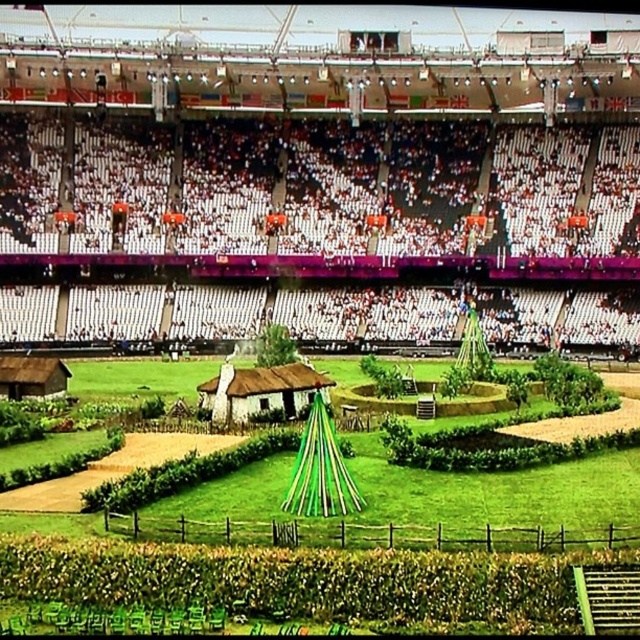
In the scene shown: Does rustic thatched hut at center have a greater height compared to brown wooden hut at lower left?

Indeed, rustic thatched hut at center has a greater height compared to brown wooden hut at lower left.

Where is `rustic thatched hut at center`? The image size is (640, 640). rustic thatched hut at center is located at coordinates (260, 390).

You are a GUI agent. You are given a task and a screenshot of the screen. Output one action in this format:
    pyautogui.click(x=<x>, y=<y>)
    Task: Click on the rustic thatched hut at center
    
    Given the screenshot: What is the action you would take?
    pyautogui.click(x=260, y=390)